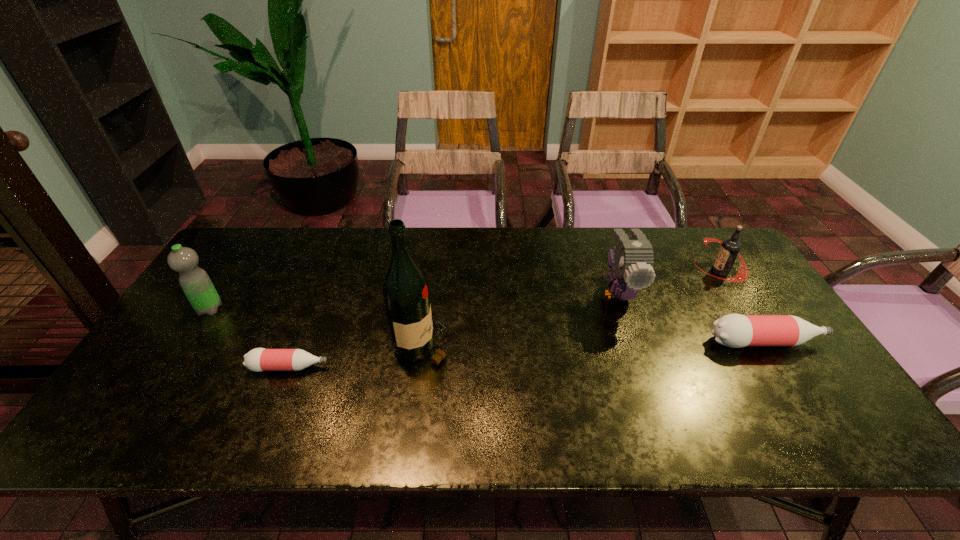
The height and width of the screenshot is (540, 960). What are the coordinates of `vacant space at the near right corner of the desktop` in the screenshot? It's located at (792, 380).

Image resolution: width=960 pixels, height=540 pixels. In order to click on vacant point located between the fifth object from right to left and the taller bottle in this screenshot , I will do pyautogui.click(x=528, y=355).

Image resolution: width=960 pixels, height=540 pixels. What are the coordinates of `empty space between the fourth tallest object and the water bottle` in the screenshot? It's located at (465, 290).

Where is `vacant area that lies between the nearer bottle and the wine bottle`? vacant area that lies between the nearer bottle and the wine bottle is located at coordinates tap(356, 356).

This screenshot has width=960, height=540. In order to click on free spot between the leftmost object and the second object from left to right in this screenshot , I will do `click(250, 338)`.

Locate an element on the screen. free spot between the tallest object and the water bottle is located at coordinates (317, 327).

Where is `unoccupied area between the root beer and the right bottle`? unoccupied area between the root beer and the right bottle is located at coordinates (743, 306).

This screenshot has width=960, height=540. I want to click on vacant area between the water bottle and the tallest object, so click(x=317, y=327).

You are a GUI agent. You are given a task and a screenshot of the screen. Output one action in this format:
    pyautogui.click(x=<x>, y=<y>)
    Task: Click on the vacant space that is in between the third object from right to left and the fifth tallest object
    
    Given the screenshot: What is the action you would take?
    pyautogui.click(x=693, y=318)

Locate an element on the screen. free space between the root beer and the third object from right to left is located at coordinates (669, 282).